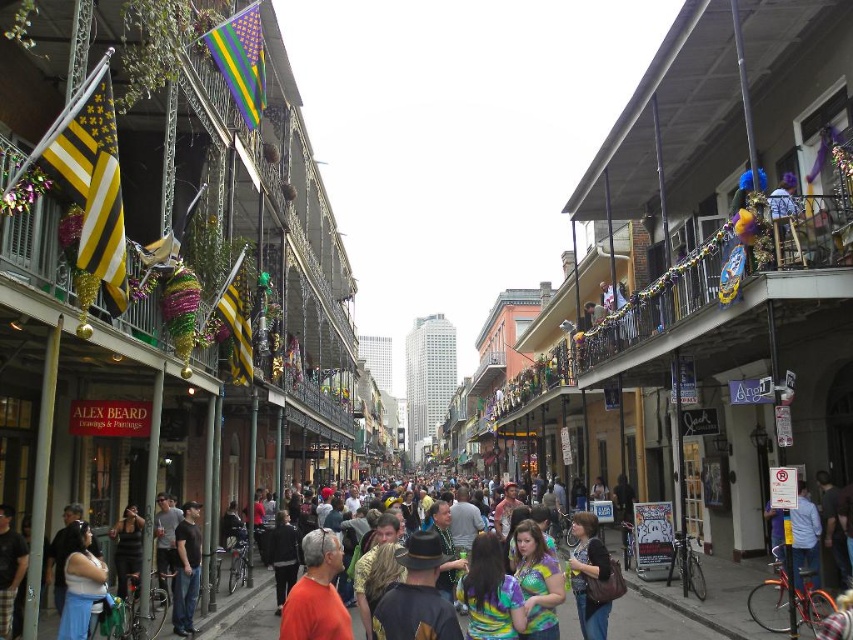
Question: Observing the image, what is the correct spatial positioning of denim jeans at center in reference to multicolored fabric crowd at center?

Choices:
 (A) left
 (B) right

Answer: (B)

Question: Does orange t-shirt at center appear under dark gray shirt at center?

Choices:
 (A) no
 (B) yes

Answer: (A)

Question: Estimate the real-world distances between objects in this image. Which object is farther from the dark gray shirt at center?

Choices:
 (A) orange t-shirt at center
 (B) denim jeans at center
 (C) multicolored fabric crowd at center

Answer: (B)

Question: Which point is closer to the camera?

Choices:
 (A) orange t-shirt at center
 (B) dark gray shirt at center
 (C) denim jeans at center

Answer: (A)

Question: Which object appears farthest from the camera in this image?

Choices:
 (A) multicolored fabric crowd at center
 (B) orange t-shirt at center

Answer: (A)

Question: Does denim jeans at center have a larger size compared to dark gray shirt at center?

Choices:
 (A) no
 (B) yes

Answer: (B)